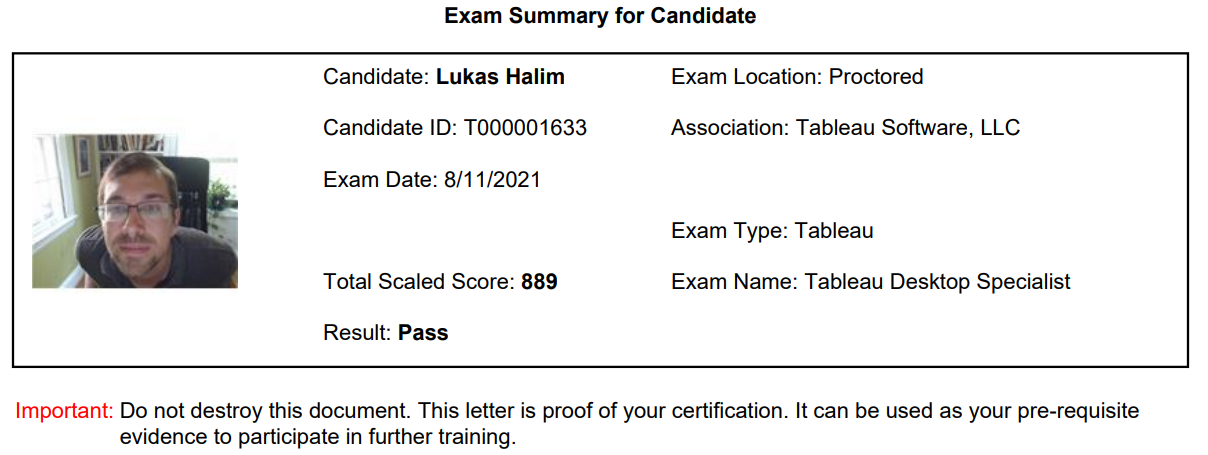
You are a GUI agent. You are given a task and a screenshot of the screen. Output one action in this format:
    pyautogui.click(x=<x>, y=<y>)
    Task: Click on the plant
    This screenshot has height=455, width=1208.
    Given the screenshot: What is the action you would take?
    pyautogui.click(x=215, y=191)